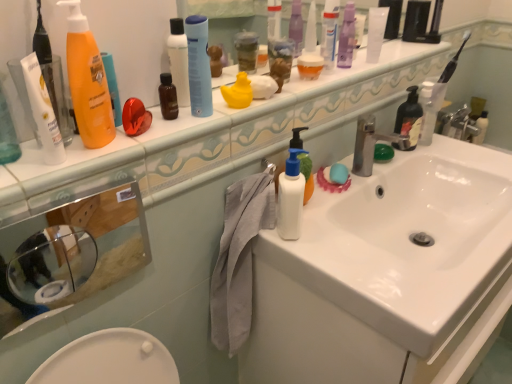
Where is `vacant area located to the right-hand side of translucent plastic container at upper center, positioned as the 5th toiletry in right-to-left order`? The image size is (512, 384). vacant area located to the right-hand side of translucent plastic container at upper center, positioned as the 5th toiletry in right-to-left order is located at coordinates (347, 74).